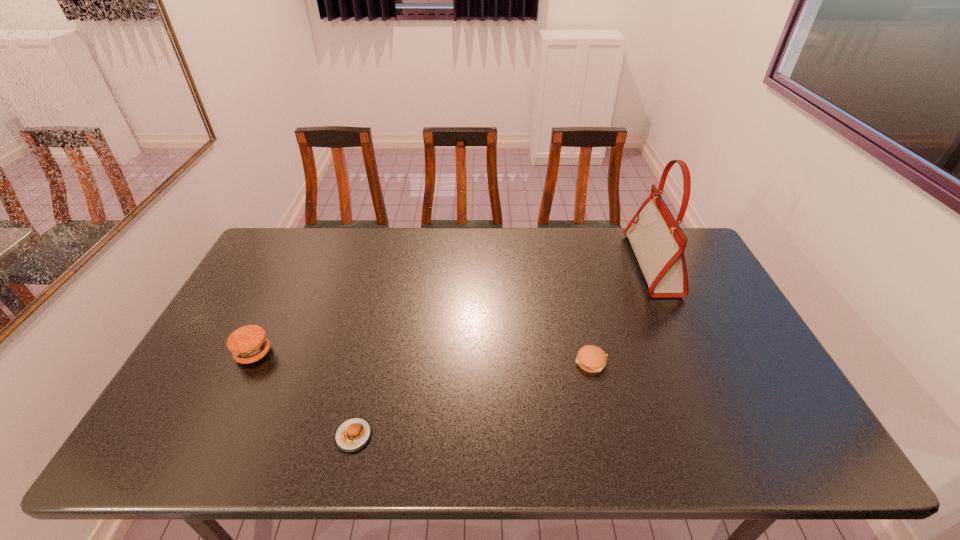
What are the coordinates of `empty space between the third shortest object and the second shortest object` in the screenshot? It's located at (422, 357).

The height and width of the screenshot is (540, 960). I want to click on free space between the farthest object and the shortest food, so click(503, 350).

Choose which object is the nearest neighbor to the handbag. Please provide its 2D coordinates. Your answer should be formatted as a tuple, i.e. [(x, y)], where the tuple contains the x and y coordinates of a point satisfying the conditions above.

[(590, 358)]

Locate which object ranks second in proximity to the tallest object. Please provide its 2D coordinates. Your answer should be formatted as a tuple, i.e. [(x, y)], where the tuple contains the x and y coordinates of a point satisfying the conditions above.

[(353, 434)]

You are a GUI agent. You are given a task and a screenshot of the screen. Output one action in this format:
    pyautogui.click(x=<x>, y=<y>)
    Task: Click on the food that is the closest to the tallest object
    Image resolution: width=960 pixels, height=540 pixels.
    Given the screenshot: What is the action you would take?
    pyautogui.click(x=590, y=358)

In order to click on food that is the second nearest to the third shortest object in this screenshot , I will do `click(590, 358)`.

Where is `free space in the image that satisfies the following two spatial constraints: 1. on the front side of the shortest food; 2. on the right side of the leftmost food`? The width and height of the screenshot is (960, 540). free space in the image that satisfies the following two spatial constraints: 1. on the front side of the shortest food; 2. on the right side of the leftmost food is located at coordinates click(x=213, y=436).

The image size is (960, 540). In order to click on vacant space that satisfies the following two spatial constraints: 1. on the front side of the tallest food; 2. on the left side of the nearest object in this screenshot , I will do `click(213, 436)`.

Where is `free region that satisfies the following two spatial constraints: 1. on the back side of the farthest object; 2. on the left side of the leftmost object`? free region that satisfies the following two spatial constraints: 1. on the back side of the farthest object; 2. on the left side of the leftmost object is located at coordinates (297, 265).